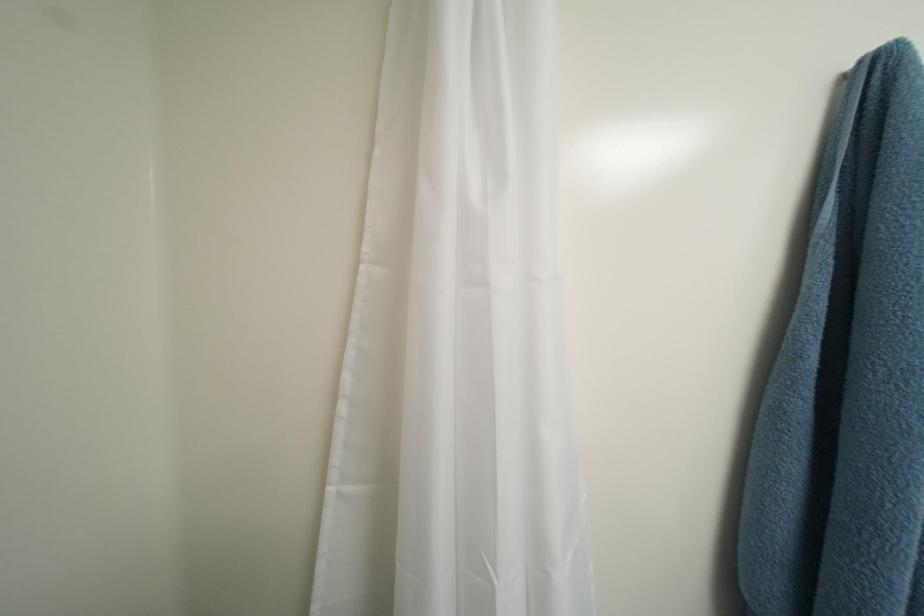
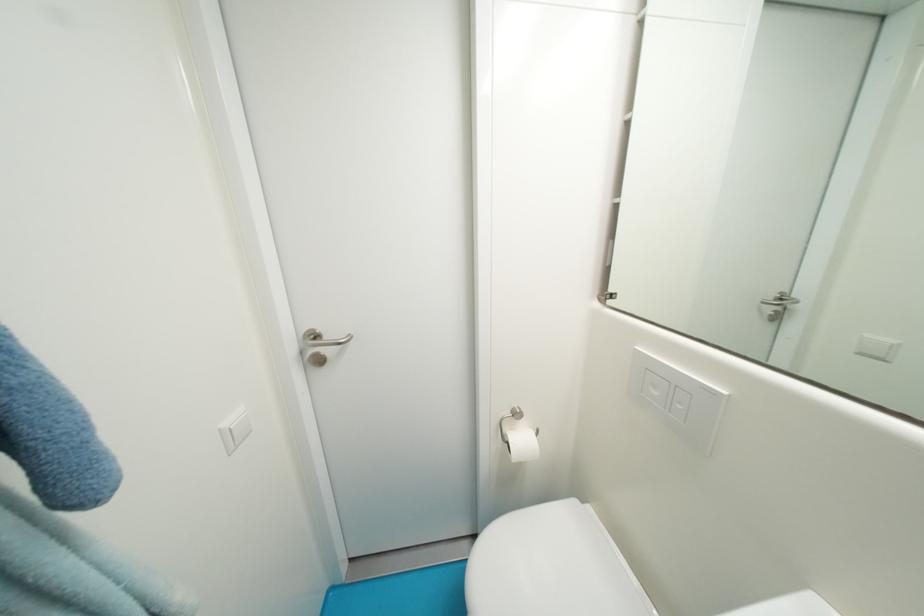
Based on the continuous images, in which direction is the camera rotating?

The rotation direction of the camera is right-down.